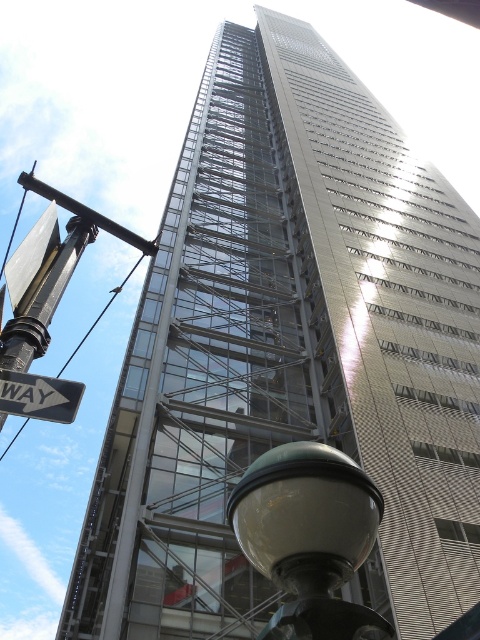
Consider the image. Is matte glass street light at lower center below black plastic street sign at left?

Indeed, matte glass street light at lower center is positioned under black plastic street sign at left.

Between matte glass street light at lower center and black plastic street sign at left, which one has less height?

Standing shorter between the two is black plastic street sign at left.

Is point (253, 504) farther from viewer compared to point (67, 397)?

That is False.

Identify the location of matte glass street light at lower center. The width and height of the screenshot is (480, 640). (309, 536).